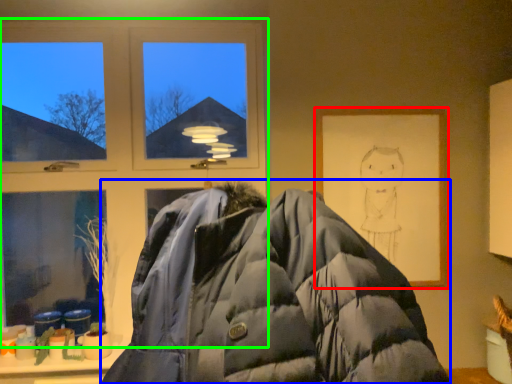
Question: Considering the real-world distances, which object is closest to picture frame (highlighted by a red box)? jacket (highlighted by a blue box) or window (highlighted by a green box).

Choices:
 (A) jacket
 (B) window

Answer: (B)